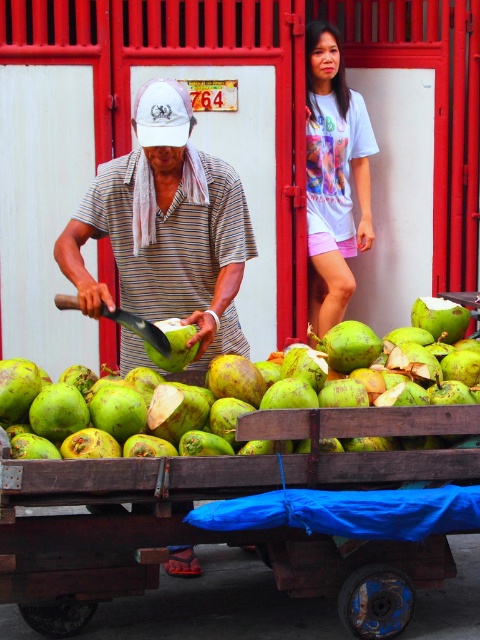
Can you confirm if green matte coconut at center is bigger than light blue t-shirt at upper center?

Yes.

The height and width of the screenshot is (640, 480). What do you see at coordinates (190, 403) in the screenshot?
I see `green matte coconut at center` at bounding box center [190, 403].

Where is `green matte coconut at center`? The height and width of the screenshot is (640, 480). green matte coconut at center is located at coordinates (190, 403).

Which is above, matte striped shirt at center or green matte coconut at center?

Positioned higher is matte striped shirt at center.

Between point (122, 243) and point (194, 390), which one is positioned behind?

The point (122, 243) is more distant.

The height and width of the screenshot is (640, 480). Find the location of `matte striped shirt at center`. matte striped shirt at center is located at coordinates (167, 228).

Consider the image. Between matte striped shirt at center and light blue t-shirt at upper center, which one appears on the left side from the viewer's perspective?

matte striped shirt at center

In order to click on matte striped shirt at center in this screenshot , I will do `click(167, 228)`.